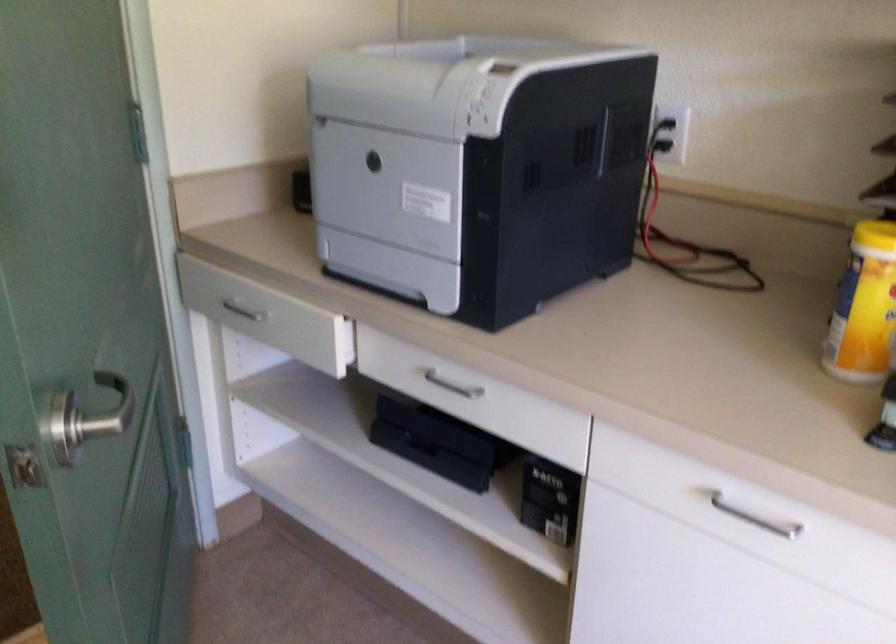
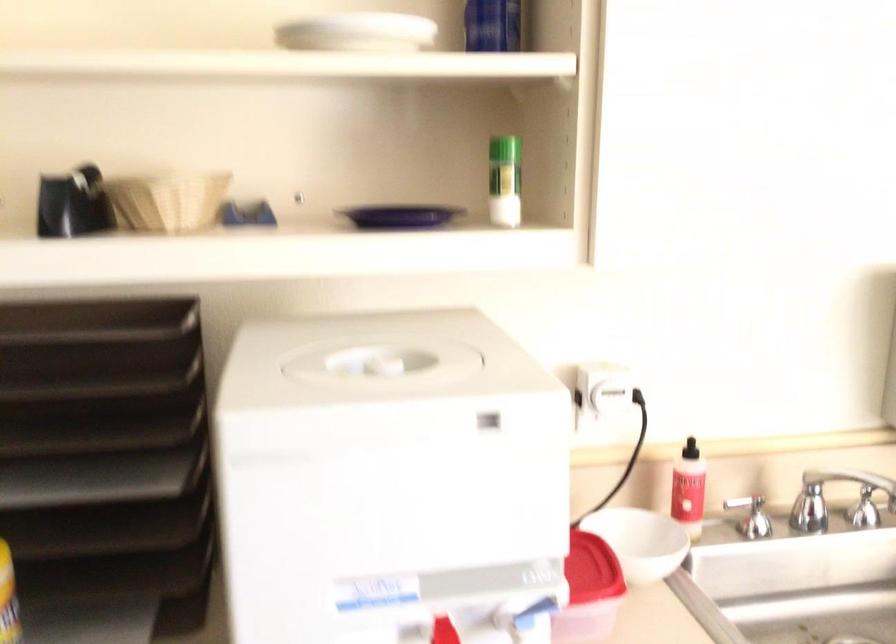
Question: The camera is either moving clockwise (left) or counter-clockwise (right) around the object. The first image is from the beginning of the video and the second image is from the end. Is the camera moving left or right when shooting the video?

Choices:
 (A) Left
 (B) Right

Answer: (A)